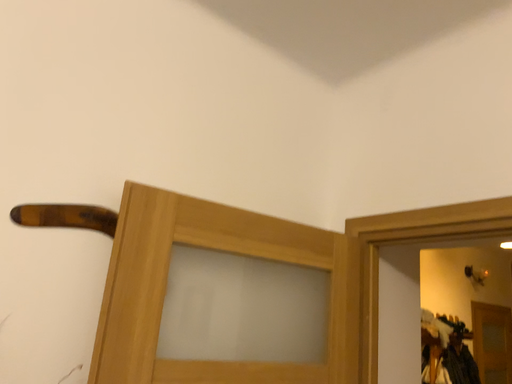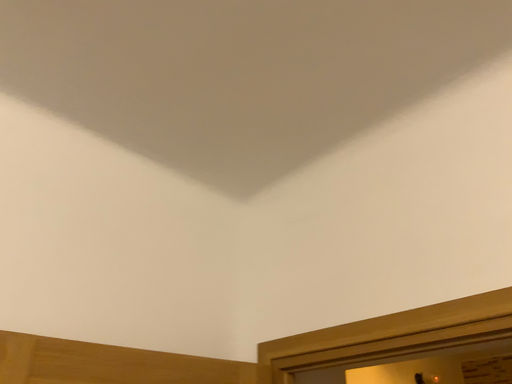
Question: How did the camera likely rotate when shooting the video?

Choices:
 (A) rotated downward
 (B) rotated upward

Answer: (B)